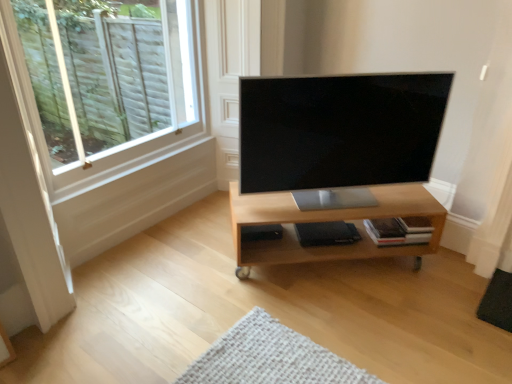
Locate an element on the screen. free space in front of light wood shelf at center is located at coordinates (350, 327).